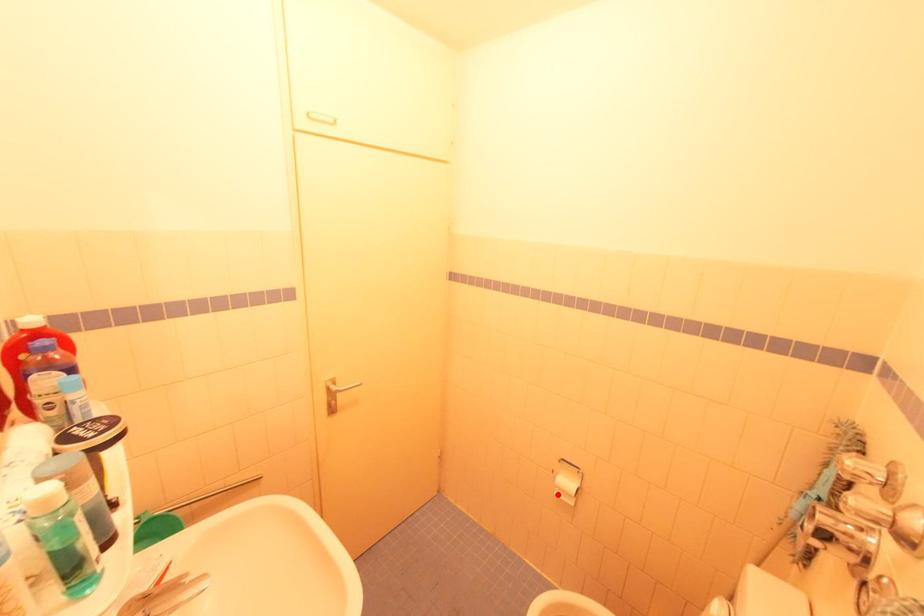
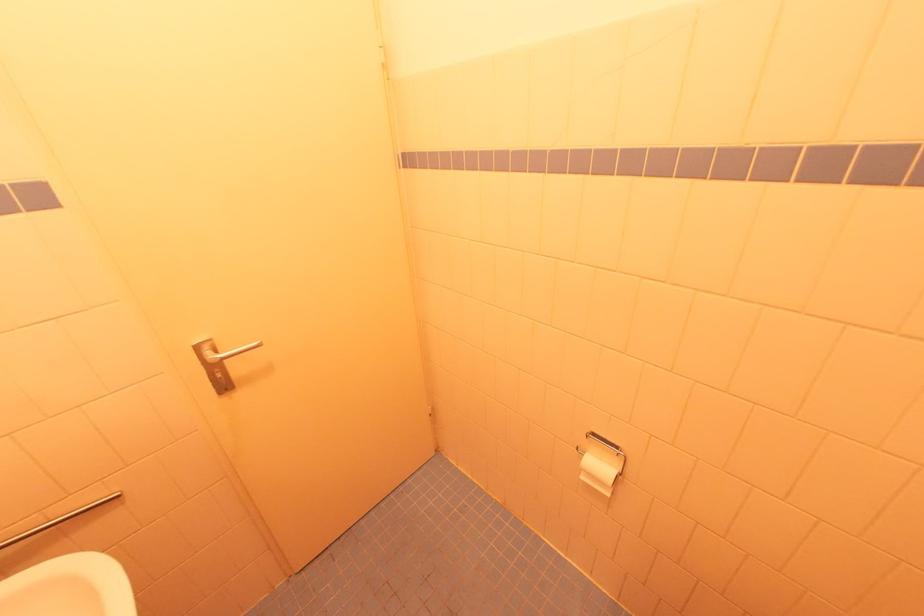
Find the pixel in the second image that matches the highlighted location in the first image.

(585, 479)